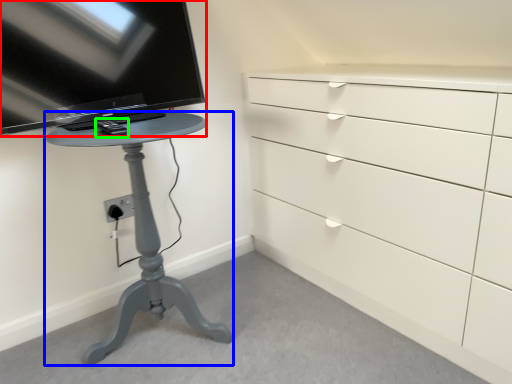
Question: Estimate the real-world distances between objects in this image. Which object is farther from television (highlighted by a red box), furniture (highlighted by a blue box) or equipment (highlighted by a green box)?

Choices:
 (A) furniture
 (B) equipment

Answer: (A)